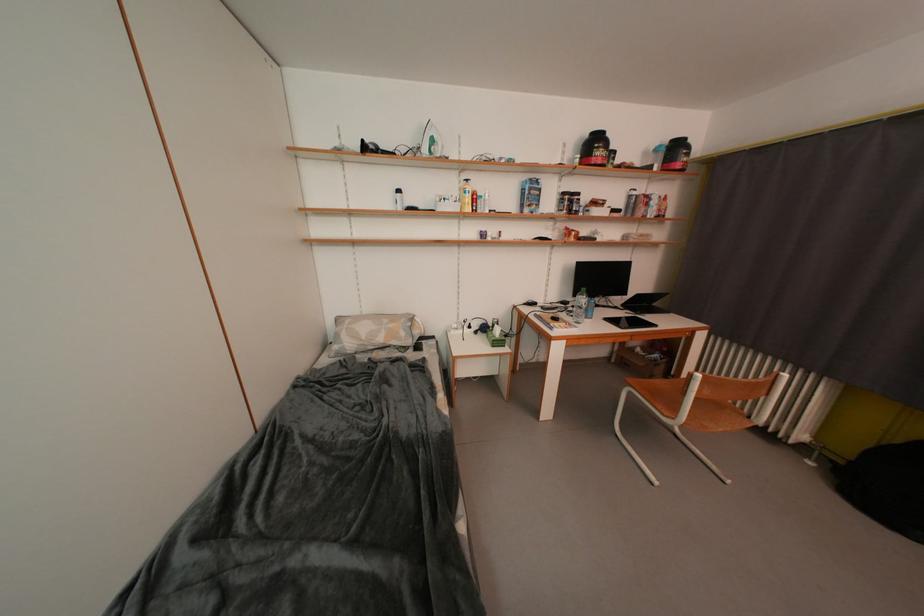
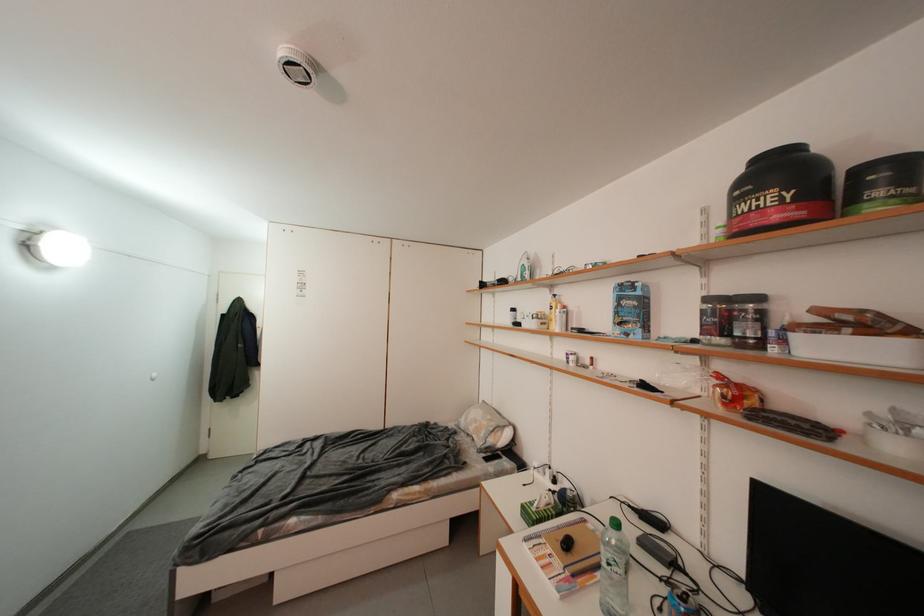
Find the pixel in the second image that matches [612,156] in the first image.

(776, 201)